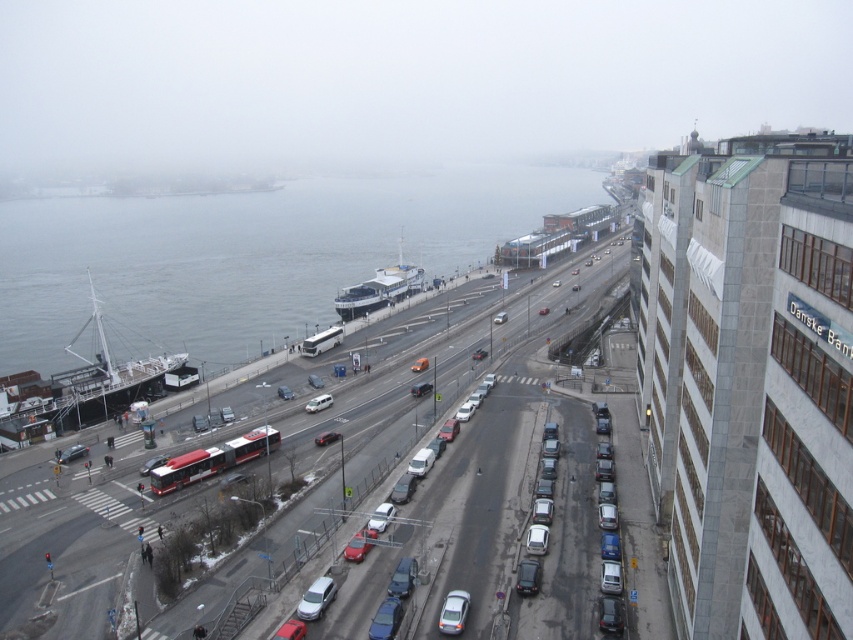
Consider the image. Does satin silver sedan at center appear over metallic silver sedan at center?

Incorrect, satin silver sedan at center is not positioned above metallic silver sedan at center.

Which is behind, point (294, 612) or point (334, 438)?

The point (334, 438) is behind.

You are a GUI agent. You are given a task and a screenshot of the screen. Output one action in this format:
    pyautogui.click(x=<x>, y=<y>)
    Task: Click on the satin silver sedan at center
    
    Given the screenshot: What is the action you would take?
    pyautogui.click(x=316, y=598)

In the scene shown: Which is below, smooth asphalt highway at center or matte black car at center?

Positioned lower is matte black car at center.

Describe the element at coordinates (462, 429) in the screenshot. I see `smooth asphalt highway at center` at that location.

The height and width of the screenshot is (640, 853). Identify the location of smooth asphalt highway at center. (462, 429).

Who is shorter, satin silver sedan at center or silver metallic van at center?

Standing shorter between the two is satin silver sedan at center.

Is satin silver sedan at center positioned in front of silver metallic van at center?

Yes, it is.

Who is more forward, [317,579] or [323,397]?

Point [317,579]

Find the location of `satin silver sedan at center`. satin silver sedan at center is located at coordinates (316, 598).